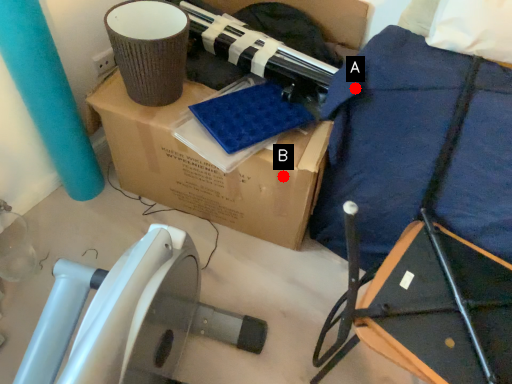
Question: Two points are circled on the image, labeled by A and B beside each circle. Among these points, which one is farthest from the camera?

Choices:
 (A) A is further
 (B) B is further

Answer: (B)